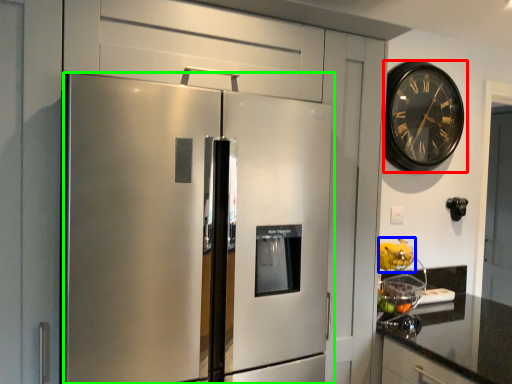
Question: Considering the real-world distances, which object is closest to wall clock (highlighted by a red box)? fruit (highlighted by a blue box) or refrigerator (highlighted by a green box).

Choices:
 (A) fruit
 (B) refrigerator

Answer: (A)